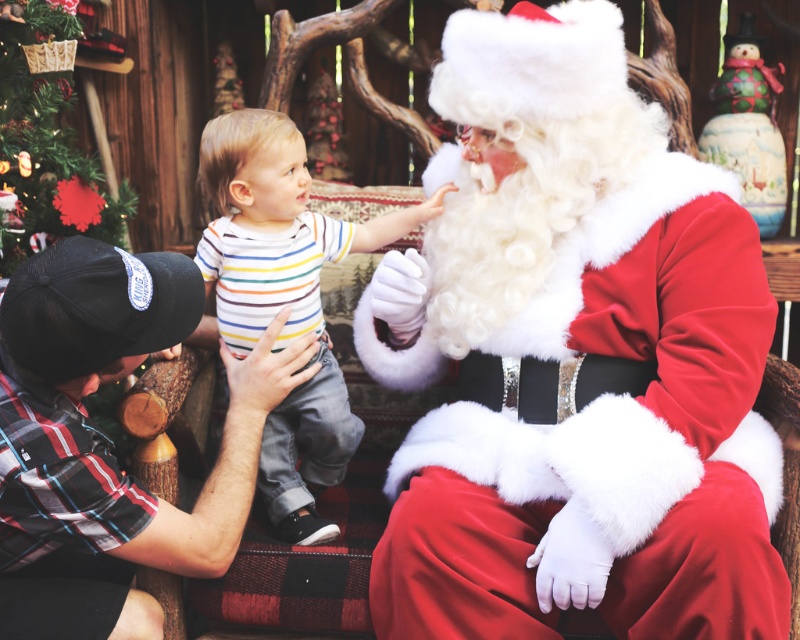
You are planning to take a photo of the velvet red santa at center and the green matte christmas tree at upper left. Which object should be placed closer to the camera to ensure both are in focus?

The velvet red santa at center is much taller than the green matte christmas tree at upper left, so to ensure both are in focus, place the velvet red santa at center closer to the camera.

You are taking a photo of Santa and the child. You notice two points in the image at coordinates point (233, 224) and point (36, 16). Which point is closer to the camera?

Point (233, 224) is closer to the camera than point (36, 16).